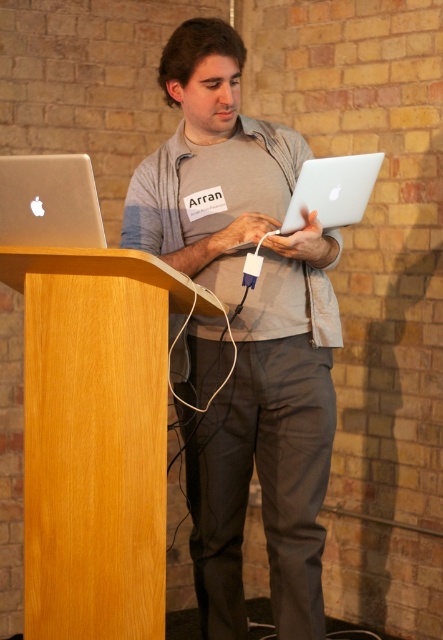
At what (x,y) coordinates should I click in order to perform the action: click on matte gray laptop at center. Please return your answer as a coordinate pair (x, y). This screenshot has height=640, width=443. Looking at the image, I should click on (268, 444).

Can you confirm if matte gray laptop at center is positioned above silver metallic laptop at left?

Actually, matte gray laptop at center is below silver metallic laptop at left.

Which is in front, point (237, 445) or point (78, 237)?

Positioned in front is point (78, 237).

This screenshot has height=640, width=443. What are the coordinates of `matte gray laptop at center` in the screenshot? It's located at (268, 444).

Between matte gray laptop at center and sleek silver laptop at center, which one is positioned higher?

sleek silver laptop at center

Is matte gray laptop at center further to camera compared to sleek silver laptop at center?

Yes, it is.

Does point (284, 433) come in front of point (334, 196)?

No, (284, 433) is behind (334, 196).

Locate an element on the screen. This screenshot has height=640, width=443. matte gray laptop at center is located at coordinates (268, 444).

Is matte gray laptop at center wider than wooden podium at left?

Yes.

Which is in front, point (295, 330) or point (42, 486)?

Positioned in front is point (42, 486).

I want to click on matte gray laptop at center, so click(268, 444).